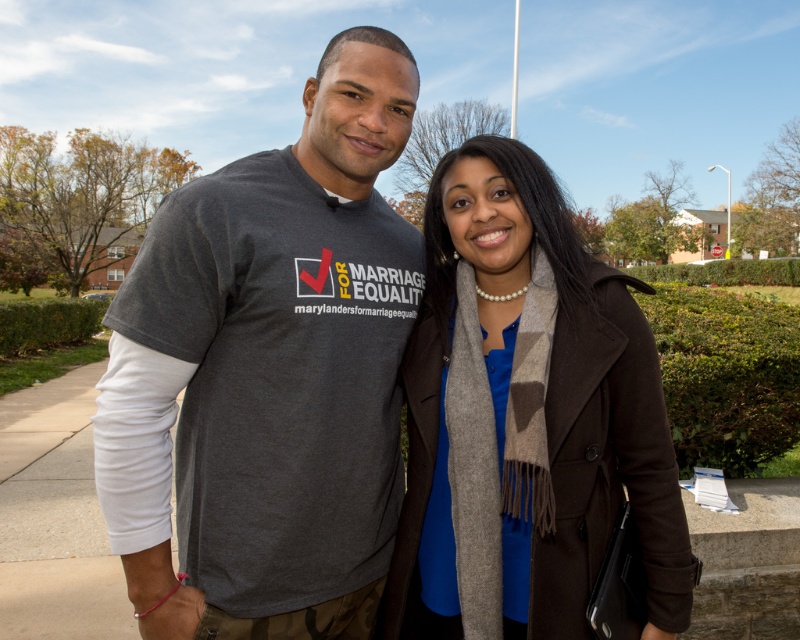
Question: Which point is farther to the camera?

Choices:
 (A) (514, 564)
 (B) (356, 234)

Answer: (B)

Question: From the image, what is the correct spatial relationship of dark gray t-shirt at center in relation to blue wool scarf at center?

Choices:
 (A) above
 (B) below

Answer: (A)

Question: Does dark gray t-shirt at center have a lesser width compared to blue wool scarf at center?

Choices:
 (A) yes
 (B) no

Answer: (A)

Question: Is dark gray t-shirt at center to the right of blue wool scarf at center from the viewer's perspective?

Choices:
 (A) yes
 (B) no

Answer: (B)